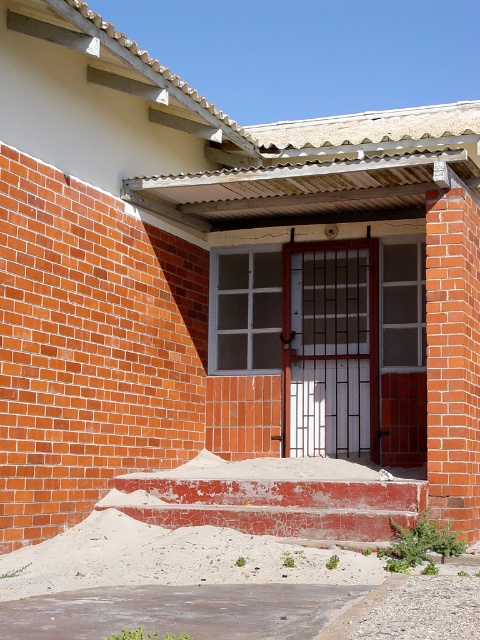
Question: Which of the following is the closest to the observer?

Choices:
 (A) white matte door at center
 (B) red brick wall at right

Answer: (B)

Question: Can you confirm if white matte door at center is positioned to the right of red brick wall at right?

Choices:
 (A) no
 (B) yes

Answer: (A)

Question: Can you confirm if white matte door at center is positioned to the left of red brick wall at right?

Choices:
 (A) no
 (B) yes

Answer: (B)

Question: Does white matte door at center have a lesser width compared to red brick wall at right?

Choices:
 (A) yes
 (B) no

Answer: (B)

Question: Which of the following is the closest to the observer?

Choices:
 (A) (301, 387)
 (B) (459, 490)

Answer: (B)